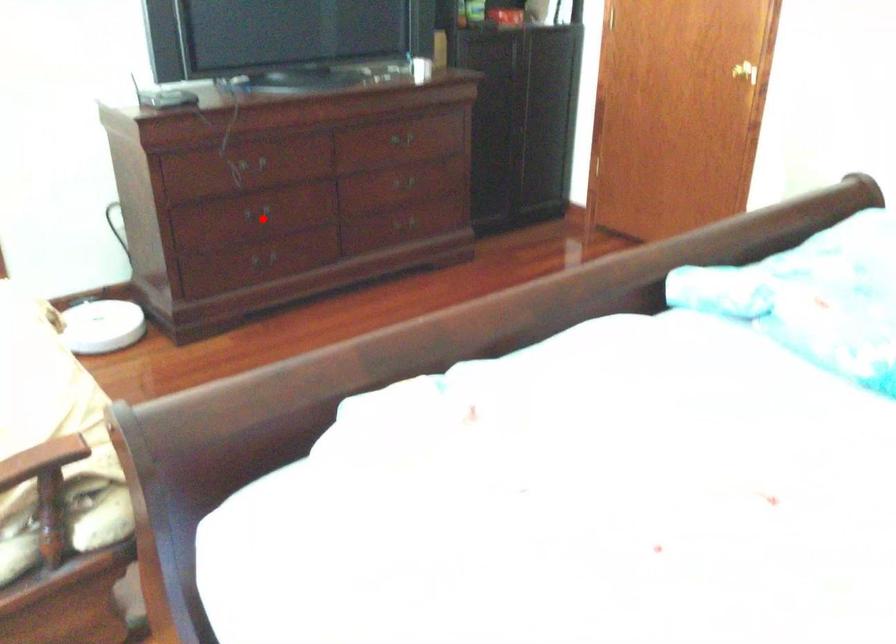
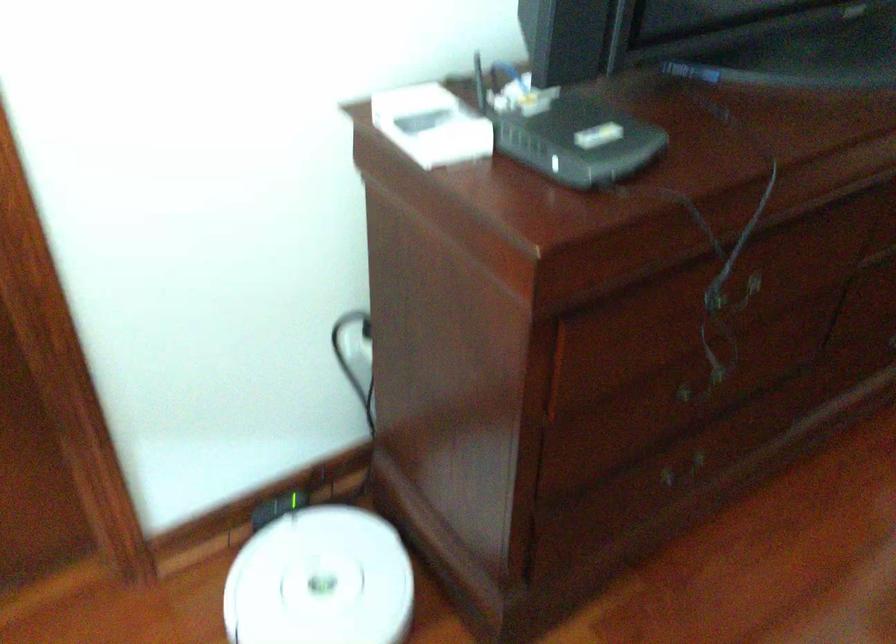
The point at the highlighted location is marked in the first image. Where is the corresponding point in the second image?

(702, 384)